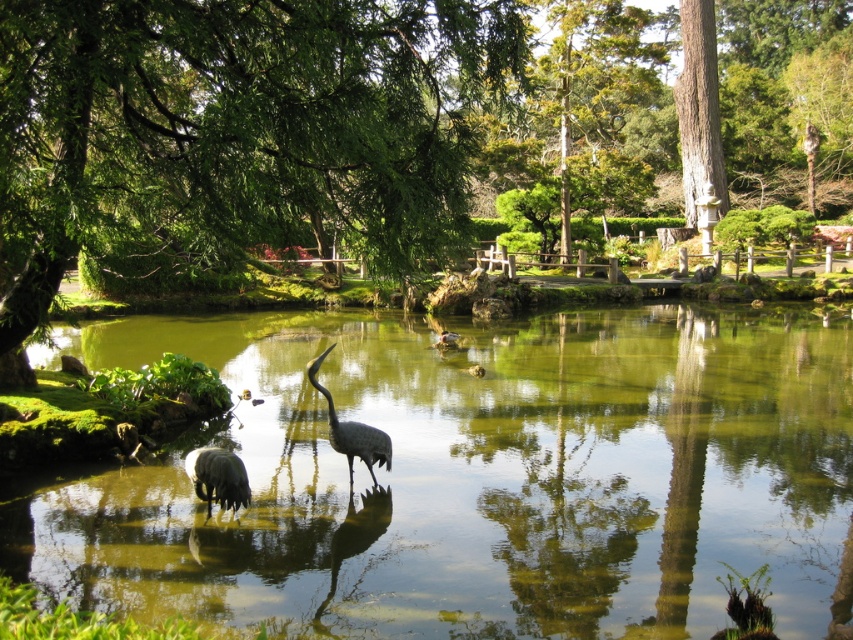
Question: Among these points, which one is farthest from the camera?

Choices:
 (A) (387, 440)
 (B) (624, 547)

Answer: (A)

Question: Which object appears farthest from the camera in this image?

Choices:
 (A) green leafy tree at center
 (B) smooth brown tree trunk at upper right

Answer: (B)

Question: Does smooth brown tree trunk at upper right have a smaller size compared to gray matte bird at center?

Choices:
 (A) yes
 (B) no

Answer: (B)

Question: Does smooth brown tree trunk at upper right appear on the left side of gray matte heron at center?

Choices:
 (A) no
 (B) yes

Answer: (A)

Question: Estimate the real-world distances between objects in this image. Which object is closer to the green reflective water at center?

Choices:
 (A) gray matte heron at center
 (B) smooth brown tree trunk at upper right
 (C) green leafy tree at center
 (D) gray matte bird at center

Answer: (D)

Question: From the image, what is the correct spatial relationship of green reflective water at center in relation to gray matte bird at center?

Choices:
 (A) above
 (B) below

Answer: (A)